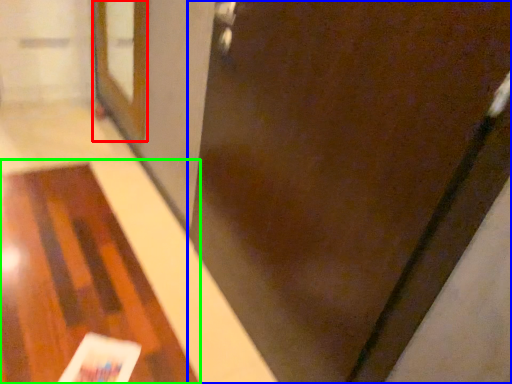
Question: Which object is positioned farthest from screen door (highlighted by a red box)? Select from door (highlighted by a blue box) and table (highlighted by a green box).

Choices:
 (A) door
 (B) table

Answer: (A)